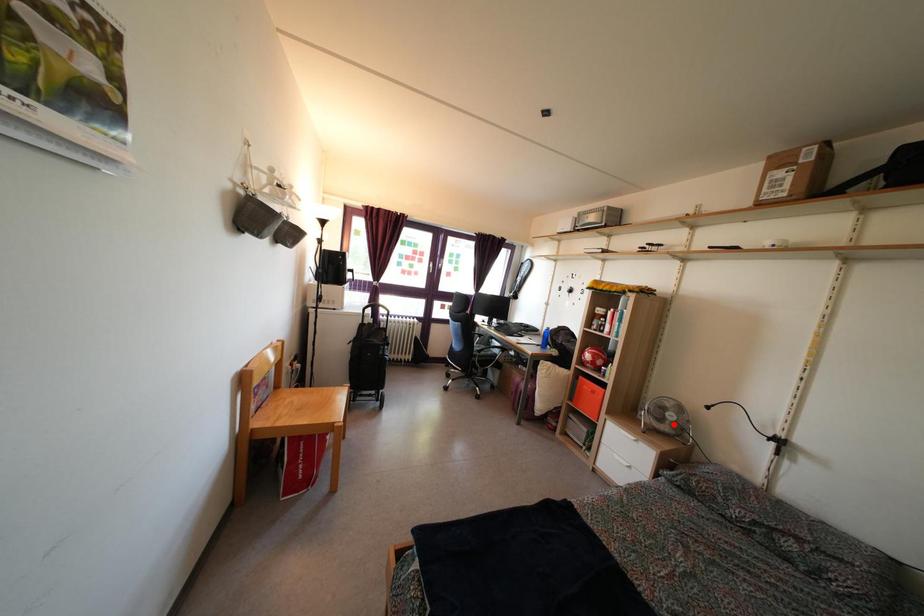
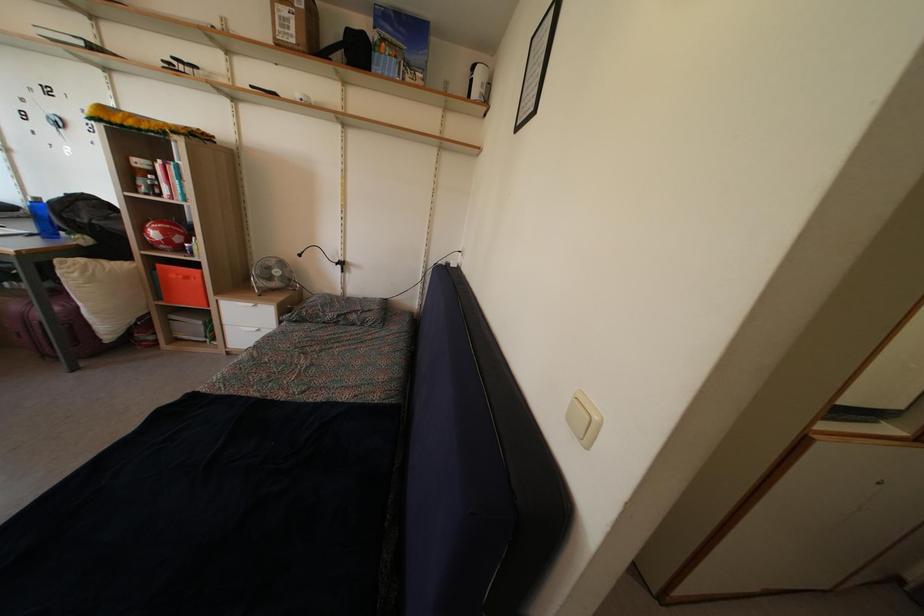
Find the pixel in the second image that matches the highlighted location in the first image.

(280, 281)